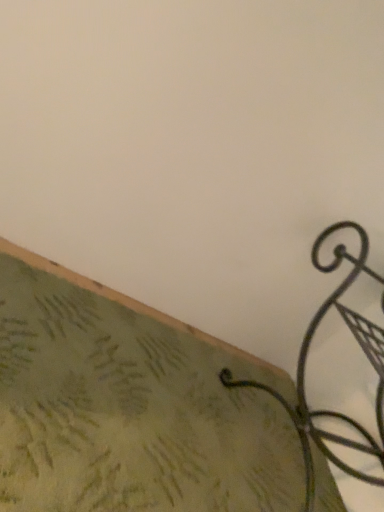
Question: Can you confirm if black wrought iron hook at lower right is taller than green textured fabric at lower left?

Choices:
 (A) yes
 (B) no

Answer: (A)

Question: Is black wrought iron hook at lower right next to green textured fabric at lower left?

Choices:
 (A) no
 (B) yes

Answer: (A)

Question: Considering the relative sizes of black wrought iron hook at lower right and green textured fabric at lower left in the image provided, is black wrought iron hook at lower right shorter than green textured fabric at lower left?

Choices:
 (A) no
 (B) yes

Answer: (A)

Question: Considering the relative sizes of black wrought iron hook at lower right and green textured fabric at lower left in the image provided, is black wrought iron hook at lower right thinner than green textured fabric at lower left?

Choices:
 (A) yes
 (B) no

Answer: (A)

Question: Is black wrought iron hook at lower right wider than green textured fabric at lower left?

Choices:
 (A) no
 (B) yes

Answer: (A)

Question: Is black wrought iron hook at lower right at the right side of green textured fabric at lower left?

Choices:
 (A) yes
 (B) no

Answer: (A)

Question: Is green textured fabric at lower left taller than black wrought iron hook at lower right?

Choices:
 (A) yes
 (B) no

Answer: (B)

Question: From a real-world perspective, is green textured fabric at lower left located beneath black wrought iron hook at lower right?

Choices:
 (A) yes
 (B) no

Answer: (A)

Question: Can we say green textured fabric at lower left lies outside black wrought iron hook at lower right?

Choices:
 (A) no
 (B) yes

Answer: (B)

Question: Is green textured fabric at lower left oriented away from black wrought iron hook at lower right?

Choices:
 (A) no
 (B) yes

Answer: (A)

Question: Is black wrought iron hook at lower right surrounded by green textured fabric at lower left?

Choices:
 (A) yes
 (B) no

Answer: (B)

Question: Is green textured fabric at lower left beside black wrought iron hook at lower right?

Choices:
 (A) yes
 (B) no

Answer: (B)

Question: In terms of size, does green textured fabric at lower left appear bigger or smaller than black wrought iron hook at lower right?

Choices:
 (A) big
 (B) small

Answer: (B)